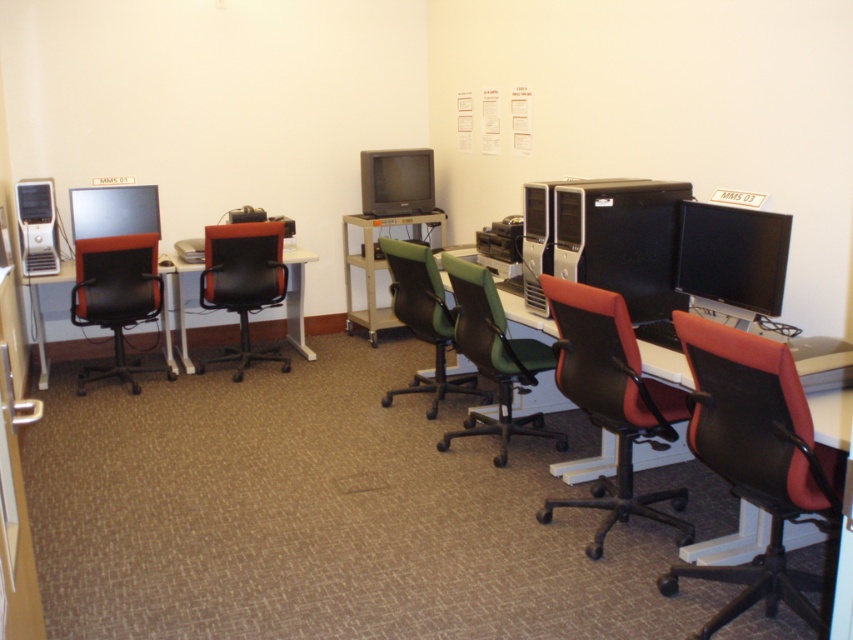
Question: In this image, where is red leather office chair at center located relative to matte black monitor at left?

Choices:
 (A) above
 (B) below

Answer: (B)

Question: Does satin black desktop at center right appear under green fabric office chair at center?

Choices:
 (A) no
 (B) yes

Answer: (A)

Question: Which object appears closest to the camera in this image?

Choices:
 (A) black leather swivel chair at right
 (B) matte black monitor at right
 (C) green fabric chair at center
 (D) matte gray monitor at center

Answer: (A)

Question: Which object is positioned closest to the matte black tower at left?

Choices:
 (A) white plastic table at left
 (B) metallic silver table at center
 (C) matte black monitor at right
 (D) matte black monitor at left

Answer: (D)

Question: Among these points, which one is farthest from the camera?

Choices:
 (A) (264, 282)
 (B) (354, 264)

Answer: (B)

Question: Does green fabric office chair at center appear on the left side of matte black tower at left?

Choices:
 (A) no
 (B) yes

Answer: (A)